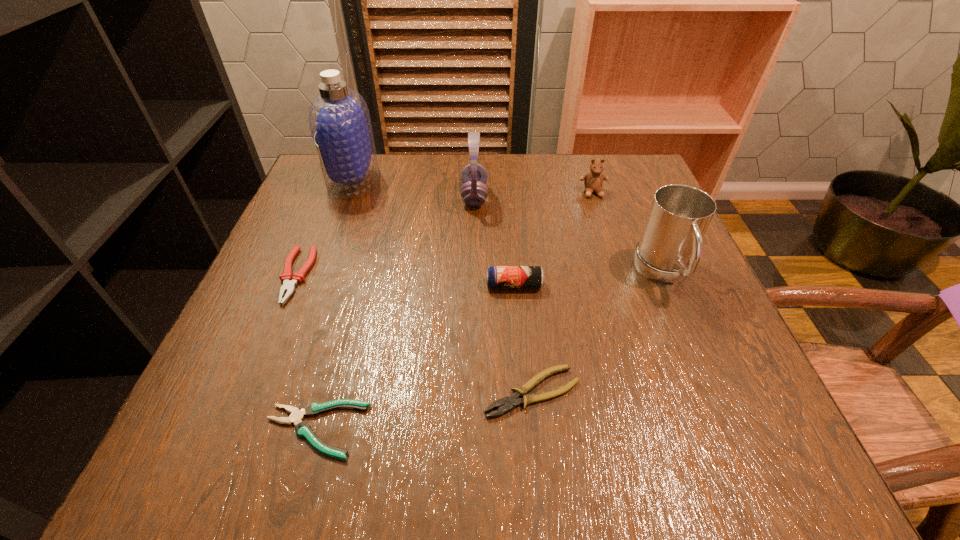
Find the location of a particular element. Image resolution: width=960 pixels, height=540 pixels. cleansing agent situated at the far edge is located at coordinates (339, 119).

Locate an element on the screen. The image size is (960, 540). headset that is at the far edge is located at coordinates (474, 191).

The width and height of the screenshot is (960, 540). Identify the location of teddy bear at the far edge. tap(593, 181).

The height and width of the screenshot is (540, 960). Find the location of `cleansing agent positioned at the left edge`. cleansing agent positioned at the left edge is located at coordinates (x=339, y=119).

You are a GUI agent. You are given a task and a screenshot of the screen. Output one action in this format:
    pyautogui.click(x=<x>, y=<y>)
    Task: Click on the mug located in the right edge section of the desktop
    The height and width of the screenshot is (540, 960).
    Given the screenshot: What is the action you would take?
    pyautogui.click(x=669, y=250)

Locate an element on the screen. The width and height of the screenshot is (960, 540). teddy bear present at the right edge is located at coordinates (593, 181).

The height and width of the screenshot is (540, 960). I want to click on object positioned at the far left corner, so click(339, 119).

Locate an element on the screen. Image resolution: width=960 pixels, height=540 pixels. object that is at the near left corner is located at coordinates (303, 429).

This screenshot has height=540, width=960. Identify the location of object positioned at the far right corner. (593, 181).

In the image, there is a desktop. Identify the location of blank space at the far edge. (538, 179).